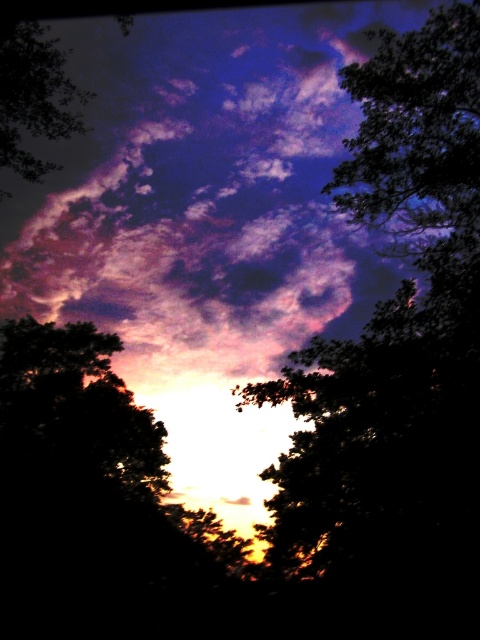
Question: Is silhouette leafy tree at upper right to the left of silhouette leafy tree at upper left from the viewer's perspective?

Choices:
 (A) yes
 (B) no

Answer: (B)

Question: Which of the following is the farthest from the observer?

Choices:
 (A) silhouette leafy tree at upper right
 (B) silhouette leafy tree at upper left

Answer: (A)

Question: Does silhouette leafy tree at upper right appear on the right side of silhouette leafy tree at upper left?

Choices:
 (A) yes
 (B) no

Answer: (A)

Question: Which of the following is the closest to the observer?

Choices:
 (A) (29, 45)
 (B) (432, 236)

Answer: (A)

Question: Among these points, which one is farthest from the camera?

Choices:
 (A) (22, 120)
 (B) (462, 148)

Answer: (A)

Question: Is silhouette leafy tree at upper right positioned before silhouette leafy tree at upper left?

Choices:
 (A) no
 (B) yes

Answer: (A)